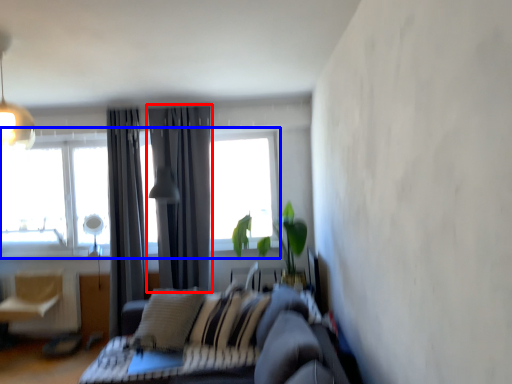
Question: Which point is further to the camera, curtain (highlighted by a red box) or window (highlighted by a blue box)?

Choices:
 (A) curtain
 (B) window

Answer: (B)